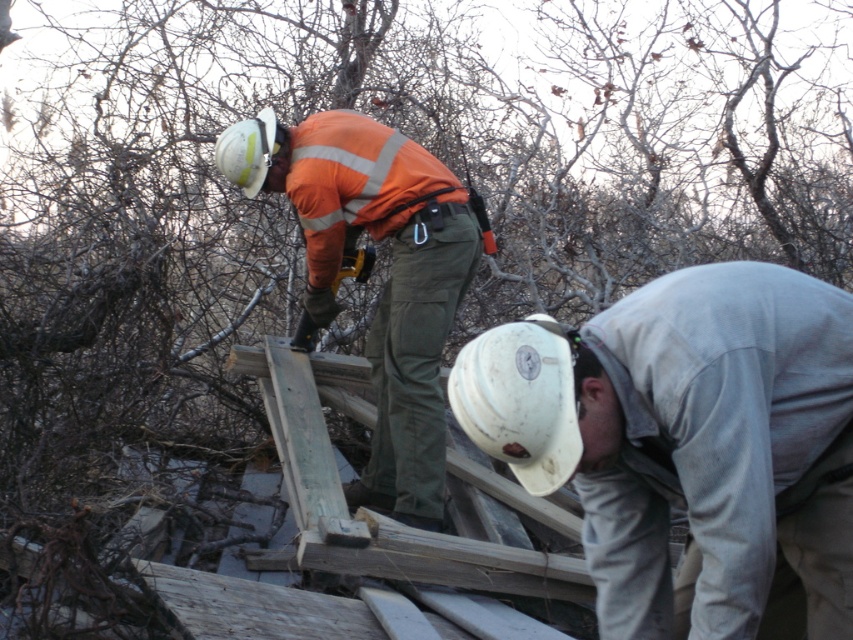
You are a safety inspector observing the construction site. You notice the white matte hard hat at lower center and the orange reflective jacket at center. Which object is positioned closer to your viewpoint?

The white matte hard hat at lower center is closer to the viewer than the orange reflective jacket at center.

Based on the scene description, where is the white matte hard hat at lower center located in terms of coordinates?

The white matte hard hat at lower center is located at coordinates (x=670, y=428).